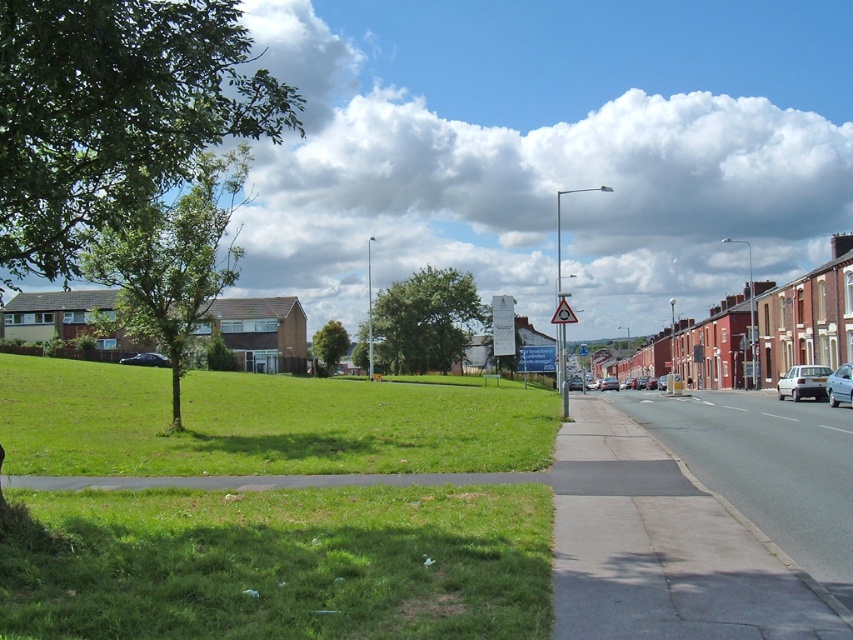
Who is more distant from viewer, (798, 390) or (566, 300)?

The point (798, 390) is behind.

Is white matte car at right wider than metallic triangular warning sign at center?

In fact, white matte car at right might be narrower than metallic triangular warning sign at center.

At what (x,y) coordinates should I click in order to perform the action: click on white matte car at right. Please return your answer as a coordinate pair (x, y). The image size is (853, 640). Looking at the image, I should click on (804, 381).

Measure the distance between white matte car at right and metallic silver sedan at right.

white matte car at right is 4.33 meters away from metallic silver sedan at right.

Which is behind, point (802, 369) or point (831, 381)?

Point (802, 369)

Locate an element on the screen. The image size is (853, 640). white matte car at right is located at coordinates (804, 381).

Can you confirm if white matte car at right is wider than silver metallic car at center-right?

In fact, white matte car at right might be narrower than silver metallic car at center-right.

The image size is (853, 640). What do you see at coordinates (804, 381) in the screenshot?
I see `white matte car at right` at bounding box center [804, 381].

Identify the location of white matte car at right. This screenshot has height=640, width=853. (804, 381).